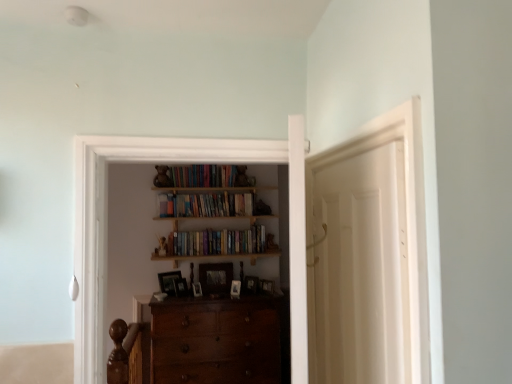
Identify the location of free space above white matte door at center (from a real-world perspective). (345, 135).